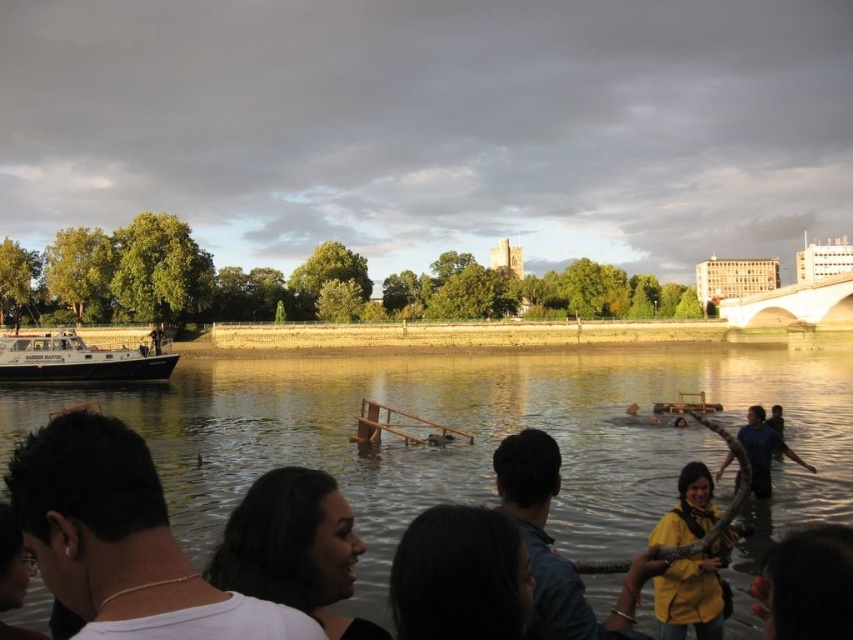
Question: Which point is farther from the camera taking this photo?

Choices:
 (A) (352, 356)
 (B) (349, 554)
 (C) (167, 540)

Answer: (A)

Question: Which point appears closest to the camera in this image?

Choices:
 (A) (762, 429)
 (B) (141, 426)
 (C) (810, 604)

Answer: (C)

Question: Which of these objects is positioned closest to the blue fabric person at lower right?

Choices:
 (A) white matte boat at left
 (B) yellow matte jacket at lower right

Answer: (B)

Question: Is dark hair at center thinner than blue fabric person at lower right?

Choices:
 (A) no
 (B) yes

Answer: (B)

Question: Is blue fabric person at lower right to the left of dark blue shirt at lower right from the viewer's perspective?

Choices:
 (A) no
 (B) yes

Answer: (B)

Question: Does yellow fabric at lower right have a lesser width compared to yellow matte jacket at lower right?

Choices:
 (A) yes
 (B) no

Answer: (B)